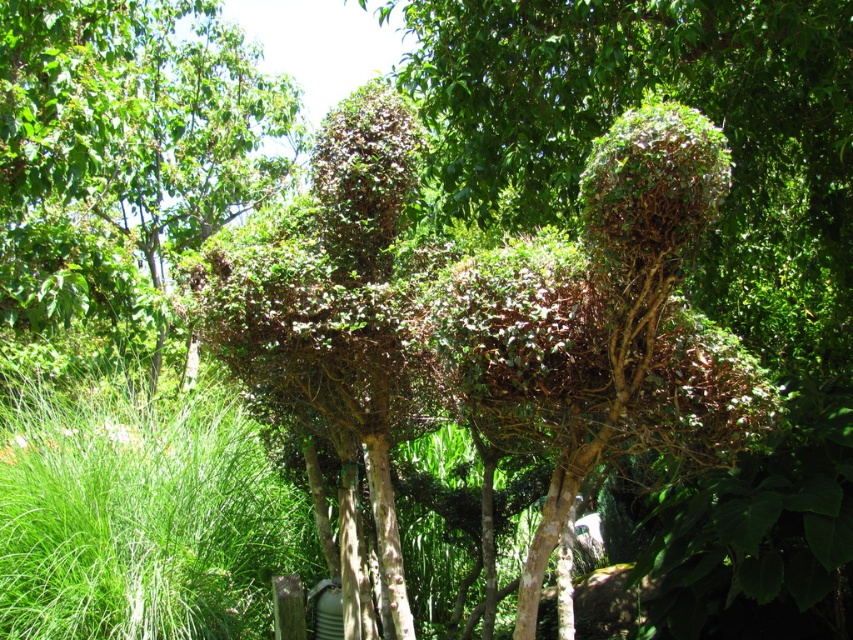
How far apart are green leafy bush at center and green leafy grass at lower left?

The distance of green leafy bush at center from green leafy grass at lower left is 8.23 feet.

Does green leafy bush at center have a lesser width compared to green leafy grass at lower left?

Yes, green leafy bush at center is thinner than green leafy grass at lower left.

Does point (277, 136) come farther from viewer compared to point (126, 419)?

Yes, point (277, 136) is farther from viewer.

You are a GUI agent. You are given a task and a screenshot of the screen. Output one action in this format:
    pyautogui.click(x=<x>, y=<y>)
    Task: Click on the green leafy bush at center
    Image resolution: width=853 pixels, height=640 pixels.
    Given the screenshot: What is the action you would take?
    pyautogui.click(x=123, y=152)